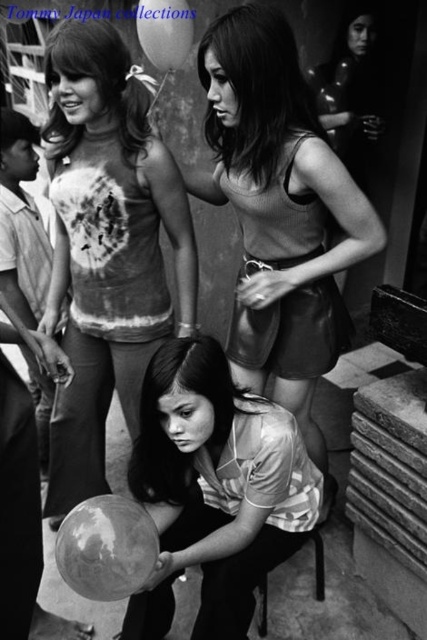
Is tie-dye fabric shirt at upper left positioned behind matte black tank top at center?

Yes, tie-dye fabric shirt at upper left is behind matte black tank top at center.

What do you see at coordinates (107, 246) in the screenshot? I see `tie-dye fabric shirt at upper left` at bounding box center [107, 246].

Is point (108, 83) behind point (366, 221)?

Yes, it is behind point (366, 221).

What are the coordinates of `tie-dye fabric shirt at upper left` in the screenshot? It's located at click(x=107, y=246).

Is point (94, 280) in front of point (263, 609)?

That is True.

How distant is tie-dye fabric shirt at upper left from metallic black chair at lower center?

They are 1.12 meters apart.

Who is more distant from viewer, [85,77] or [266,579]?

Point [266,579]

Find the location of a particular element. The height and width of the screenshot is (640, 427). tie-dye fabric shirt at upper left is located at coordinates (107, 246).

Is tie-dye fabric shirt at upper left taller than striped fabric blouse at center?

Yes.

Between tie-dye fabric shirt at upper left and striped fabric blouse at center, which one is positioned higher?

tie-dye fabric shirt at upper left is higher up.

Between point (155, 138) and point (218, 445), which one is positioned in front?

Point (218, 445)

The image size is (427, 640). In order to click on tie-dye fabric shirt at upper left in this screenshot , I will do `click(107, 246)`.